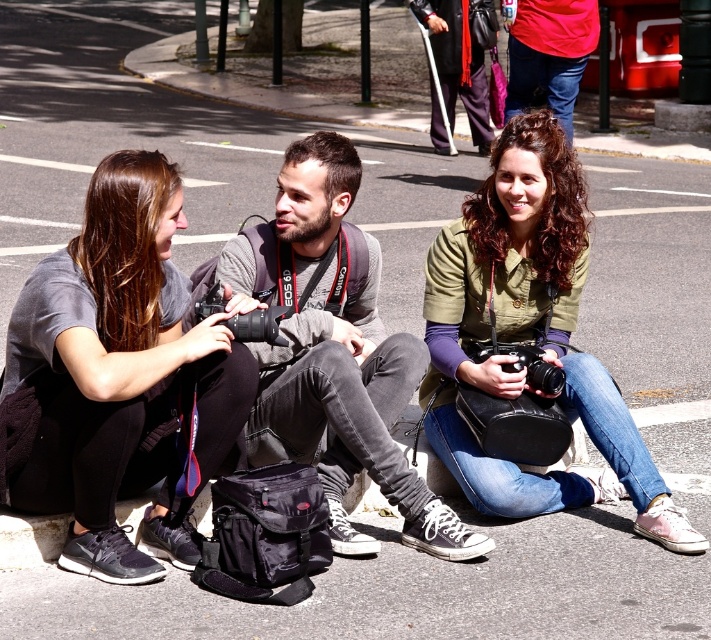
How distant is matte black camera at left from green matte shirt at center?

A distance of 1.65 meters exists between matte black camera at left and green matte shirt at center.

Who is taller, matte black camera at left or green matte shirt at center?

green matte shirt at center is taller.

This screenshot has width=711, height=640. I want to click on matte black camera at left, so click(117, 378).

Image resolution: width=711 pixels, height=640 pixels. I want to click on matte black camera at left, so click(117, 378).

Who is positioned more to the left, green matte shirt at center or matte gray shirt at center?

Positioned to the left is matte gray shirt at center.

At what (x,y) coordinates should I click in order to perform the action: click on green matte shirt at center. Please return your answer as a coordinate pair (x, y). This screenshot has height=640, width=711. Looking at the image, I should click on (530, 336).

Who is positioned more to the left, matte black camera at left or matte gray shirt at center?

matte black camera at left

Consider the image. Does matte black camera at left lie behind matte gray shirt at center?

No, matte black camera at left is in front of matte gray shirt at center.

You are a GUI agent. You are given a task and a screenshot of the screen. Output one action in this format:
    pyautogui.click(x=<x>, y=<y>)
    Task: Click on the matte black camera at left
    The height and width of the screenshot is (640, 711).
    Given the screenshot: What is the action you would take?
    pyautogui.click(x=117, y=378)

Find the location of a particular element. This screenshot has width=711, height=640. matte black camera at left is located at coordinates (117, 378).